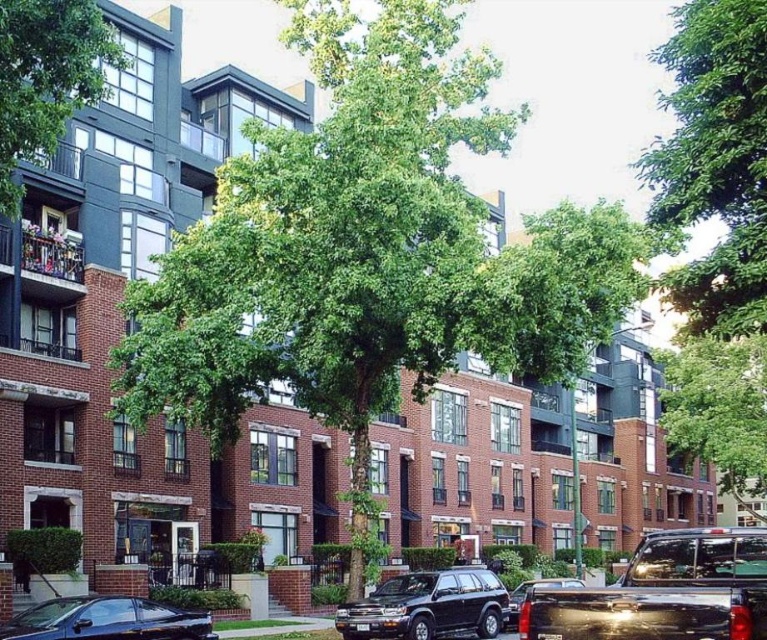
You are a city planner analyzing the street layout. You need to determine which tree has a smaller trunk diameter between the green leafy tree at center and the green leafy tree at upper center. Which one is it?

The green leafy tree at center has a smaller trunk diameter than the green leafy tree at upper center.

You are standing at the point marked as point (x=713, y=161) in the image. Looking around, you see a green leafy tree at upper center. What object is located exactly at your current position?

The point (x=713, y=161) is occupied by the green leafy tree at upper center.

You are a delivery driver who needs to park the shiny black car at lower left without hitting the green leafy tree at upper right. Considering their widths, which one is wider?

The green leafy tree at upper right is wider than the shiny black car at lower left according to the description.